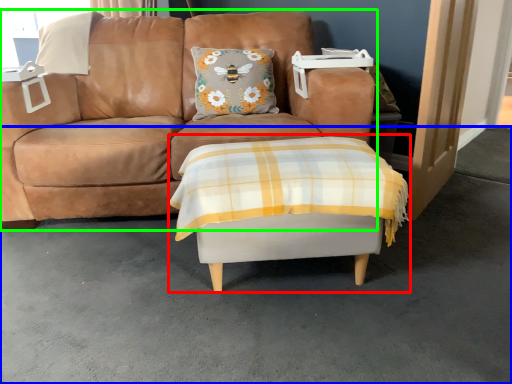
Question: Estimate the real-world distances between objects in this image. Which object is closer to table (highlighted by a red box), concrete (highlighted by a blue box) or studio couch (highlighted by a green box)?

Choices:
 (A) concrete
 (B) studio couch

Answer: (A)